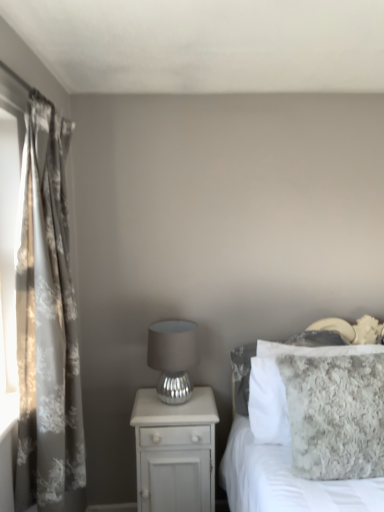
In the scene shown: Measure the distance between fuzzy gray blanket at right and camera.

The depth of fuzzy gray blanket at right is 4.85 feet.

The width and height of the screenshot is (384, 512). What do you see at coordinates (173, 358) in the screenshot? I see `matte silver table lamp at center` at bounding box center [173, 358].

Measure the distance between white glossy nightstand at lower left and camera.

The depth of white glossy nightstand at lower left is 1.97 meters.

Find the location of `fuzzy gray blanket at right`. fuzzy gray blanket at right is located at coordinates (278, 443).

From the image's perspective, is fuzzy gray blanket at right located above floral-patterned fabric curtain at left?

No.

Is point (296, 345) positioned behind point (78, 468)?

Yes.

Does fuzzy gray blanket at right turn towards floral-patterned fabric curtain at left?

No, fuzzy gray blanket at right is not turned towards floral-patterned fabric curtain at left.

At what (x,y) coordinates should I click in order to perform the action: click on curtain behind the fuzzy gray blanket at right. Please return your answer as a coordinate pair (x, y). This screenshot has height=512, width=384. Looking at the image, I should click on (47, 324).

Considering the positions of point (164, 423) and point (160, 358), is point (164, 423) closer or farther from the camera than point (160, 358)?

Point (164, 423) appears to be closer to the viewer than point (160, 358).

Does white glossy nightstand at lower left appear on the left side of matte silver table lamp at center?

No.

From a real-world perspective, is white glossy nightstand at lower left physically above matte silver table lamp at center?

No, from a real-world perspective, white glossy nightstand at lower left is not over matte silver table lamp at center

How far apart are white glossy nightstand at lower left and matte silver table lamp at center?

white glossy nightstand at lower left is 24.56 centimeters from matte silver table lamp at center.

Is white glossy nightstand at lower left completely or partially outside of floral-patterned fabric curtain at left?

Yes, white glossy nightstand at lower left is located beyond the bounds of floral-patterned fabric curtain at left.

Is white glossy nightstand at lower left taller or shorter than floral-patterned fabric curtain at left?

Clearly, white glossy nightstand at lower left is shorter compared to floral-patterned fabric curtain at left.

Is white glossy nightstand at lower left placed right next to floral-patterned fabric curtain at left?

No.

From the image's perspective, does white glossy nightstand at lower left appear higher than floral-patterned fabric curtain at left?

Actually, white glossy nightstand at lower left appears below floral-patterned fabric curtain at left in the image.

Between white glossy nightstand at lower left and fuzzy gray blanket at right, which one has less height?

With less height is white glossy nightstand at lower left.

Is white glossy nightstand at lower left facing away from fuzzy gray blanket at right?

white glossy nightstand at lower left is not turned away from fuzzy gray blanket at right.

Is white glossy nightstand at lower left at the left side of fuzzy gray blanket at right?

Correct, you'll find white glossy nightstand at lower left to the left of fuzzy gray blanket at right.

Would you say white glossy nightstand at lower left is inside or outside fuzzy gray blanket at right?

Answer: white glossy nightstand at lower left cannot be found inside fuzzy gray blanket at right.

From the image's perspective, is fuzzy gray blanket at right positioned above or below white glossy nightstand at lower left?

fuzzy gray blanket at right is situated higher than white glossy nightstand at lower left in the image.

Considering the relative sizes of fuzzy gray blanket at right and white glossy nightstand at lower left in the image provided, is fuzzy gray blanket at right smaller than white glossy nightstand at lower left?

No.

From a real-world perspective, is fuzzy gray blanket at right physically located above or below white glossy nightstand at lower left?

fuzzy gray blanket at right is situated higher than white glossy nightstand at lower left in the real world.

How much distance is there between fuzzy gray blanket at right and white glossy nightstand at lower left?

12.37 inches.

Could you tell me if floral-patterned fabric curtain at left is turned towards matte silver table lamp at center?

No, floral-patterned fabric curtain at left is not oriented towards matte silver table lamp at center.

Considering the relative sizes of floral-patterned fabric curtain at left and matte silver table lamp at center in the image provided, is floral-patterned fabric curtain at left wider than matte silver table lamp at center?

No.

Is floral-patterned fabric curtain at left located outside matte silver table lamp at center?

Indeed, floral-patterned fabric curtain at left is completely outside matte silver table lamp at center.

From a real-world perspective, which object rests below the other?

matte silver table lamp at center, from a real-world perspective.

Which of these two, matte silver table lamp at center or floral-patterned fabric curtain at left, stands taller?

floral-patterned fabric curtain at left.

This screenshot has height=512, width=384. What are the coordinates of `table lamp behind the floral-patterned fabric curtain at left` in the screenshot? It's located at (173, 358).

What's the angular difference between matte silver table lamp at center and floral-patterned fabric curtain at left's facing directions?

The angular difference between matte silver table lamp at center and floral-patterned fabric curtain at left is 88.9 degrees.

Locate an element on the screen. The width and height of the screenshot is (384, 512). bed on the right of floral-patterned fabric curtain at left is located at coordinates (278, 443).

The width and height of the screenshot is (384, 512). Identify the location of table lamp above the white glossy nightstand at lower left (from the image's perspective). (173, 358).

Estimate the real-world distances between objects in this image. Which object is further from floral-patterned fabric curtain at left, white glossy nightstand at lower left or fuzzy gray blanket at right?

fuzzy gray blanket at right lies further to floral-patterned fabric curtain at left than the other object.

Considering their positions, is white glossy nightstand at lower left positioned closer to floral-patterned fabric curtain at left than matte silver table lamp at center?

white glossy nightstand at lower left.

Considering their positions, is fuzzy gray blanket at right positioned further to white glossy nightstand at lower left than matte silver table lamp at center?

Among the two, fuzzy gray blanket at right is located further to white glossy nightstand at lower left.

Considering their positions, is matte silver table lamp at center positioned further to fuzzy gray blanket at right than white glossy nightstand at lower left?

The object further to fuzzy gray blanket at right is matte silver table lamp at center.

Based on their spatial positions, is floral-patterned fabric curtain at left or matte silver table lamp at center closer to white glossy nightstand at lower left?

matte silver table lamp at center is closer to white glossy nightstand at lower left.

Based on their spatial positions, is white glossy nightstand at lower left or fuzzy gray blanket at right further from matte silver table lamp at center?

fuzzy gray blanket at right is positioned further to the anchor matte silver table lamp at center.

Looking at the image, which one is located closer to fuzzy gray blanket at right, white glossy nightstand at lower left or matte silver table lamp at center?

Among the two, white glossy nightstand at lower left is located nearer to fuzzy gray blanket at right.

In the scene shown: When comparing their distances from white glossy nightstand at lower left, does floral-patterned fabric curtain at left or fuzzy gray blanket at right seem closer?

fuzzy gray blanket at right is closer to white glossy nightstand at lower left.

In order to click on table lamp that lies between floral-patterned fabric curtain at left and white glossy nightstand at lower left from top to bottom in this screenshot , I will do `click(173, 358)`.

You are a GUI agent. You are given a task and a screenshot of the screen. Output one action in this format:
    pyautogui.click(x=<x>, y=<y>)
    Task: Click on the curtain positioned between fuzzy gray blanket at right and matte silver table lamp at center from near to far
    The width and height of the screenshot is (384, 512).
    Given the screenshot: What is the action you would take?
    pyautogui.click(x=47, y=324)

In order to click on curtain positioned between fuzzy gray blanket at right and white glossy nightstand at lower left from near to far in this screenshot , I will do `click(47, 324)`.

I want to click on table lamp between fuzzy gray blanket at right and white glossy nightstand at lower left in the front-back direction, so click(x=173, y=358).